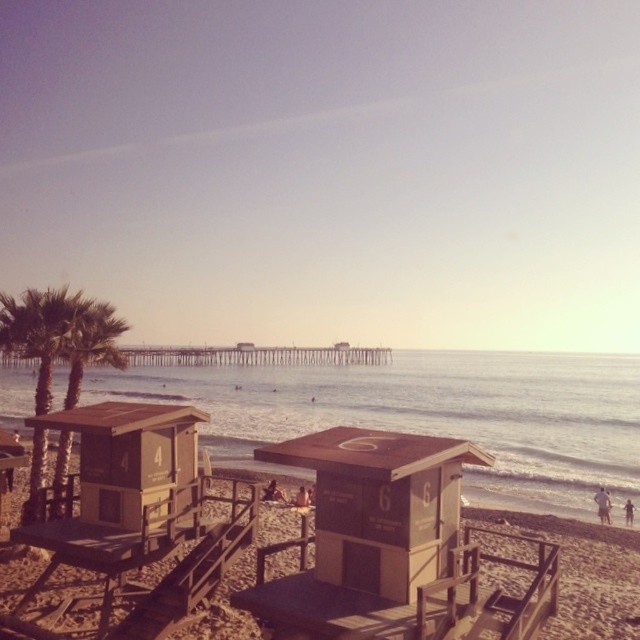
Question: Does brown sandy beach at center appear under brown wood lifeguard tower at center?

Choices:
 (A) yes
 (B) no

Answer: (A)

Question: Which object is positioned closest to the wooden lifeguard tower at lower left?

Choices:
 (A) brown wood lifeguard tower at center
 (B) brown sandy beach at center

Answer: (B)

Question: Which of the following is the farthest from the observer?

Choices:
 (A) green leafy palm tree at left
 (B) brown wood lifeguard tower at center
 (C) wooden lifeguard tower at lower left
 (D) clear blue water at center

Answer: (D)

Question: Is brown wood lifeguard tower at center bigger than wooden lifeguard tower at lower left?

Choices:
 (A) yes
 (B) no

Answer: (B)

Question: Does brown wood lifeguard tower at center have a greater width compared to green leafy palm tree at left?

Choices:
 (A) yes
 (B) no

Answer: (B)

Question: Among these objects, which one is nearest to the camera?

Choices:
 (A) brown sandy beach at center
 (B) wooden lifeguard tower at lower left
 (C) clear blue water at center
 (D) green leafy palm tree at left

Answer: (A)